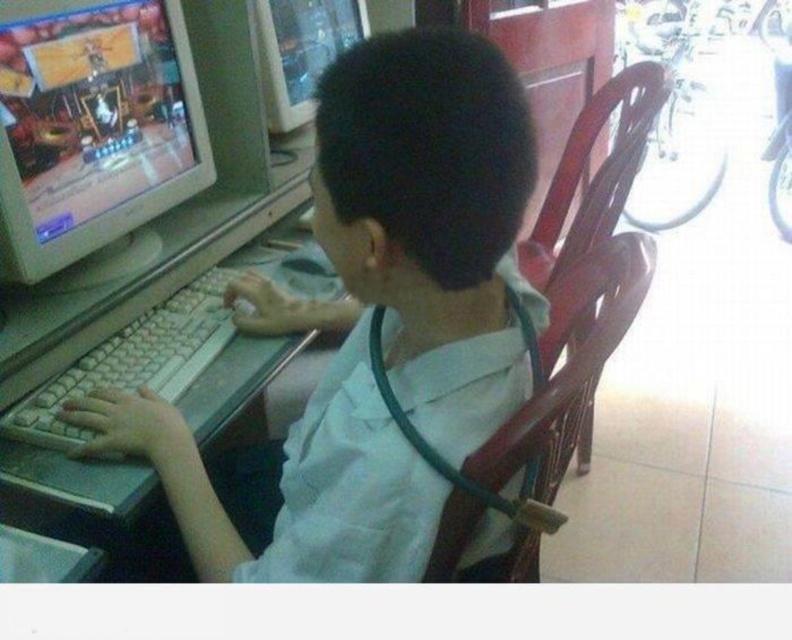
Question: Is wooden chair at center to the right of matte plastic computer monitor at upper center from the viewer's perspective?

Choices:
 (A) no
 (B) yes

Answer: (B)

Question: Which object is the closest to the wooden chair at center?

Choices:
 (A) wooden chair at right
 (B) white plastic keyboard at center
 (C) white matte shirt at center

Answer: (C)

Question: Which object appears farthest from the camera in this image?

Choices:
 (A) wooden chair at right
 (B) matte plastic monitor at left
 (C) white matte shirt at center

Answer: (A)

Question: Observing the image, what is the correct spatial positioning of matte plastic monitor at left in reference to white plastic keyboard at center?

Choices:
 (A) below
 (B) above

Answer: (B)

Question: Which object appears farthest from the camera in this image?

Choices:
 (A) matte plastic monitor at left
 (B) matte plastic computer monitor at upper center
 (C) wooden chair at center

Answer: (B)

Question: Does white plastic keyboard at center have a lesser width compared to matte plastic computer monitor at upper center?

Choices:
 (A) no
 (B) yes

Answer: (A)